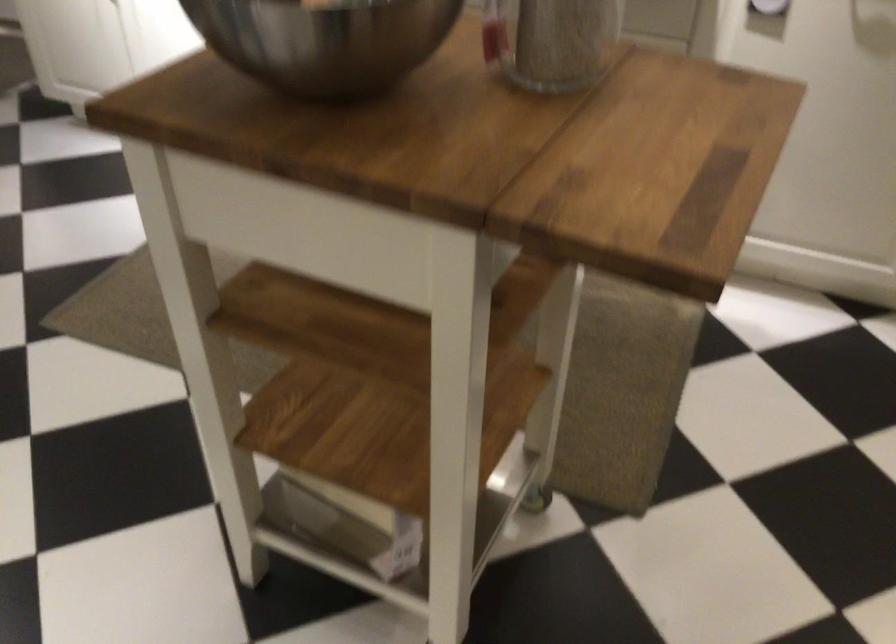
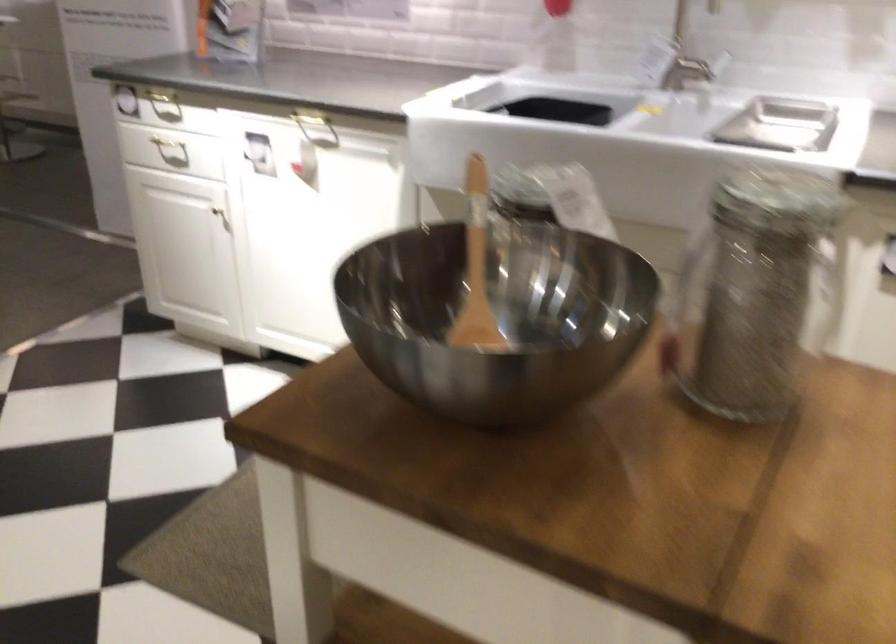
Looking at this image, in a continuous first-person perspective shot, in which direction is the camera moving?

The cameraman walked toward left, forward.